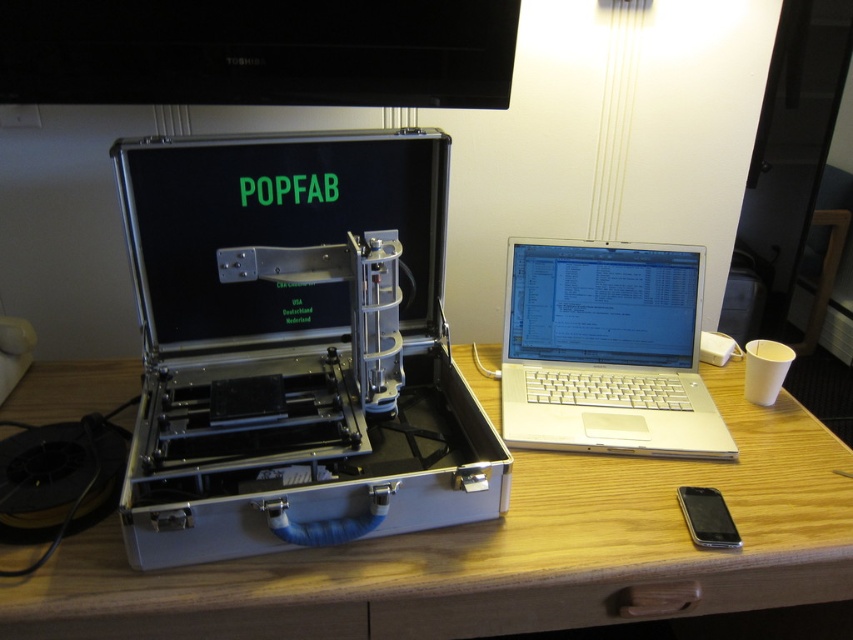
Question: Where is silver metallic case at center located in relation to wooden table at center in the image?

Choices:
 (A) below
 (B) above

Answer: (B)

Question: Among these points, which one is nearest to the camera?

Choices:
 (A) coord(374,326)
 (B) coord(582,305)

Answer: (A)

Question: Which of the following is the closest to the observer?

Choices:
 (A) silver metallic laptop at center
 (B) silver metallic case at center
 (C) wooden table at center

Answer: (C)

Question: Is wooden table at center to the left of silver metallic laptop at center from the viewer's perspective?

Choices:
 (A) yes
 (B) no

Answer: (A)

Question: Based on their relative distances, which object is nearer to the silver metallic case at center?

Choices:
 (A) wooden table at center
 (B) silver metallic laptop at center

Answer: (A)

Question: Does silver metallic case at center have a lesser width compared to wooden table at center?

Choices:
 (A) yes
 (B) no

Answer: (A)